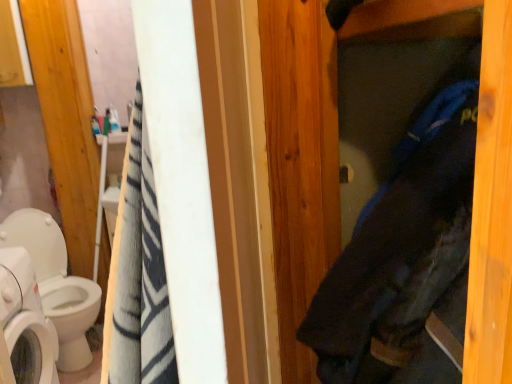
This screenshot has height=384, width=512. In order to click on dark blue fabric at center in this screenshot , I will do `click(403, 247)`.

What do you see at coordinates (26, 320) in the screenshot?
I see `white glossy washing machine at lower left` at bounding box center [26, 320].

What is the approximate width of white glossy toilet at left?

The width of white glossy toilet at left is 24.22 inches.

What do you see at coordinates (56, 283) in the screenshot?
I see `white glossy toilet at left` at bounding box center [56, 283].

At what (x,y) coordinates should I click in order to perform the action: click on dark blue fabric at center. Please return your answer as a coordinate pair (x, y). Looking at the image, I should click on (403, 247).

Does white glossy washing machine at lower left turn towards dark blue fabric at center?

No, white glossy washing machine at lower left is not turned towards dark blue fabric at center.

Is dark blue fabric at center inside white glossy washing machine at lower left?

No.

I want to click on washing machine below the dark blue fabric at center (from the image's perspective), so click(x=26, y=320).

Between white glossy washing machine at lower left and dark blue fabric at center, which one has smaller size?

Smaller between the two is white glossy washing machine at lower left.

Does white glossy toilet at left have a lesser height compared to white glossy washing machine at lower left?

No, white glossy toilet at left is not shorter than white glossy washing machine at lower left.

Can you confirm if white glossy toilet at left is positioned to the left of white glossy washing machine at lower left?

Correct, you'll find white glossy toilet at left to the left of white glossy washing machine at lower left.

Does white glossy toilet at left turn towards white glossy washing machine at lower left?

No, white glossy toilet at left is not facing towards white glossy washing machine at lower left.

Are white glossy toilet at left and white glossy washing machine at lower left beside each other?

No, white glossy toilet at left is not making contact with white glossy washing machine at lower left.

From the image's perspective, is white glossy washing machine at lower left above or below white glossy toilet at left?

Clearly, from the image's perspective, white glossy washing machine at lower left is below white glossy toilet at left.

I want to click on toilet above the white glossy washing machine at lower left (from the image's perspective), so click(x=56, y=283).

In the scene shown: Considering the relative sizes of white glossy washing machine at lower left and white glossy toilet at left in the image provided, is white glossy washing machine at lower left shorter than white glossy toilet at left?

Indeed, white glossy washing machine at lower left has a lesser height compared to white glossy toilet at left.

Considering the relative sizes of white glossy washing machine at lower left and white glossy toilet at left in the image provided, is white glossy washing machine at lower left smaller than white glossy toilet at left?

Yes, white glossy washing machine at lower left is smaller than white glossy toilet at left.

Are dark blue fabric at center and white glossy toilet at left beside each other?

There is a gap between dark blue fabric at center and white glossy toilet at left.

Is dark blue fabric at center wider than white glossy toilet at left?

No.

Between point (467, 83) and point (66, 293), which one is positioned in front?

The point (467, 83) is more forward.

Find the location of a particular element. The width and height of the screenshot is (512, 384). clothing lying in front of the white glossy toilet at left is located at coordinates (403, 247).

Do you think white glossy toilet at left is within dark blue fabric at center, or outside of it?

white glossy toilet at left is not inside dark blue fabric at center, it's outside.

Is white glossy toilet at left wider than dark blue fabric at center?

Correct, the width of white glossy toilet at left exceeds that of dark blue fabric at center.

Is white glossy toilet at left facing towards dark blue fabric at center?

Yes, white glossy toilet at left is turned towards dark blue fabric at center.

Is dark blue fabric at center further to camera compared to white glossy washing machine at lower left?

No.

Considering the sizes of objects dark blue fabric at center and white glossy washing machine at lower left in the image provided, who is wider, dark blue fabric at center or white glossy washing machine at lower left?

Wider between the two is dark blue fabric at center.

Does dark blue fabric at center have a smaller size compared to white glossy washing machine at lower left?

Actually, dark blue fabric at center might be larger than white glossy washing machine at lower left.

Identify the location of clothing in front of the white glossy washing machine at lower left. The height and width of the screenshot is (384, 512). pos(403,247).

Locate an element on the screen. toilet directly beneath the white glossy washing machine at lower left (from a real-world perspective) is located at coordinates click(x=56, y=283).

From the image, which object appears to be nearer to white glossy washing machine at lower left, white glossy toilet at left or dark blue fabric at center?

white glossy toilet at left lies closer to white glossy washing machine at lower left than the other object.

From the picture: Which object lies nearer to the anchor point white glossy washing machine at lower left, dark blue fabric at center or white glossy toilet at left?

white glossy toilet at left is positioned closer to the anchor white glossy washing machine at lower left.

From the image, which object appears to be nearer to dark blue fabric at center, white glossy toilet at left or white glossy washing machine at lower left?

white glossy washing machine at lower left.

Considering their positions, is white glossy washing machine at lower left positioned further to dark blue fabric at center than white glossy toilet at left?

The object further to dark blue fabric at center is white glossy toilet at left.

Estimate the real-world distances between objects in this image. Which object is further from white glossy toilet at left, dark blue fabric at center or white glossy washing machine at lower left?

Based on the image, dark blue fabric at center appears to be further to white glossy toilet at left.

Which object lies further to the anchor point white glossy toilet at left, white glossy washing machine at lower left or dark blue fabric at center?

dark blue fabric at center is positioned further to the anchor white glossy toilet at left.

Find the location of a particular element. The width and height of the screenshot is (512, 384). washing machine between white glossy toilet at left and dark blue fabric at center from left to right is located at coordinates pos(26,320).